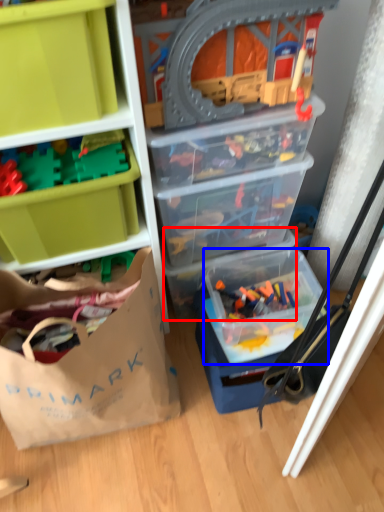
Question: Which of the following is the farthest to the observer, storage box (highlighted by a red box) or storage box (highlighted by a blue box)?

Choices:
 (A) storage box
 (B) storage box

Answer: (A)